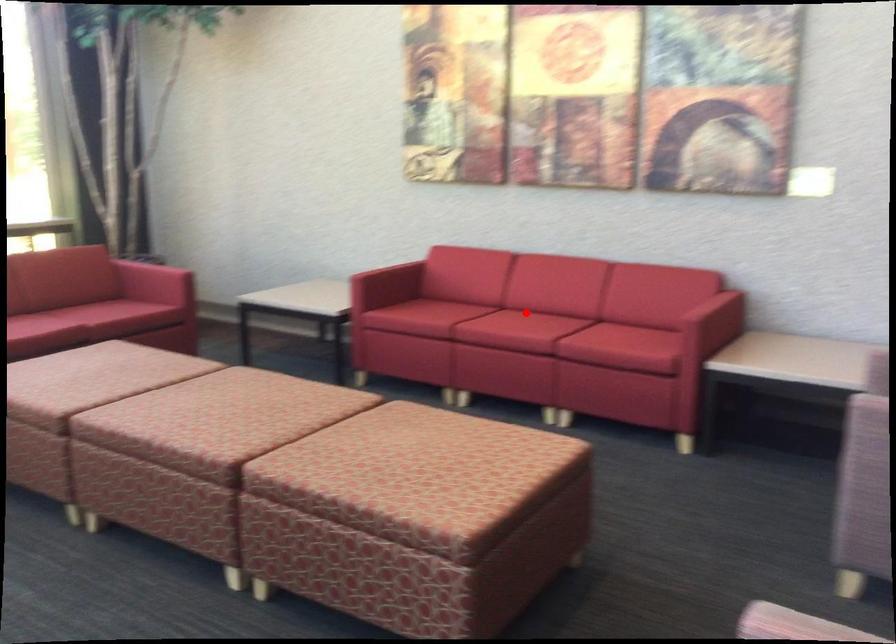
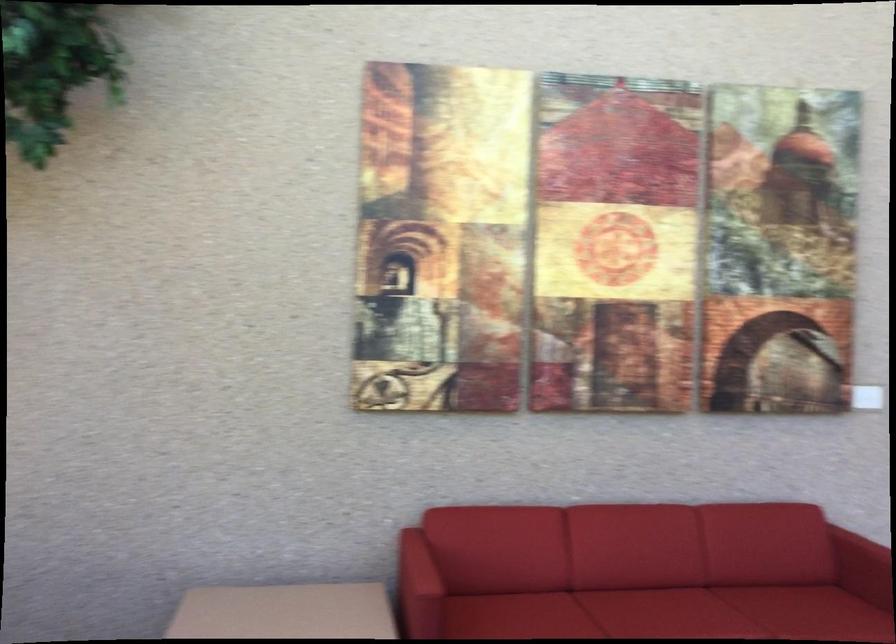
Question: I am providing you with two images of the same scene from different viewpoints. In image1, a red point is highlighted. Considering the same 3D point in image2, which of the following is correct?

Choices:
 (A) It is closer
 (B) It is farther

Answer: (A)